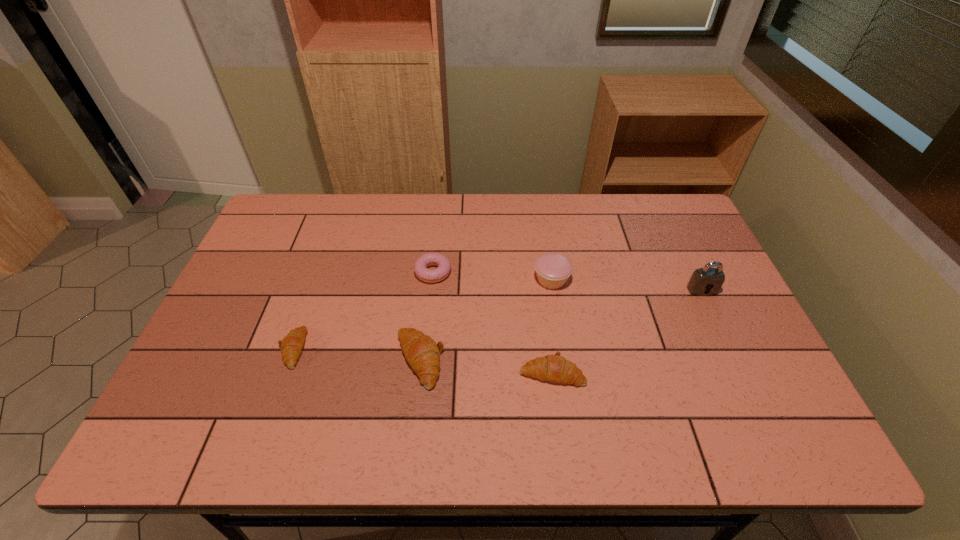
You are a GUI agent. You are given a task and a screenshot of the screen. Output one action in this format:
    pyautogui.click(x=<x>, y=<y>)
    Task: Click on the vacant area that lies between the leftmost crescent roll and the tallest object
    The image size is (960, 540).
    Given the screenshot: What is the action you would take?
    pyautogui.click(x=497, y=319)

Identify which object is located as the fourth nearest to the third tallest object. Please provide its 2D coordinates. Your answer should be formatted as a tuple, i.e. [(x, y)], where the tuple contains the x and y coordinates of a point satisfying the conditions above.

[(553, 269)]

The image size is (960, 540). Identify the location of the fifth closest object relative to the doughnut. (702, 280).

I want to click on the closest crescent roll to the rightmost crescent roll, so click(x=422, y=353).

The image size is (960, 540). Identify the location of crescent roll that stands as the second closest to the leftmost object. (555, 368).

The height and width of the screenshot is (540, 960). Identify the location of free space that satisfies the following two spatial constraints: 1. on the front side of the doughnut; 2. on the right side of the second tallest object. (432, 280).

Locate an element on the screen. This screenshot has height=540, width=960. free location that satisfies the following two spatial constraints: 1. on the back side of the cupcake; 2. on the left side of the second shortest crescent roll is located at coordinates (540, 280).

Where is `vacant region that satisfies the following two spatial constraints: 1. on the back side of the doughnut; 2. on the right side of the leftmost crescent roll`? Image resolution: width=960 pixels, height=540 pixels. vacant region that satisfies the following two spatial constraints: 1. on the back side of the doughnut; 2. on the right side of the leftmost crescent roll is located at coordinates (320, 272).